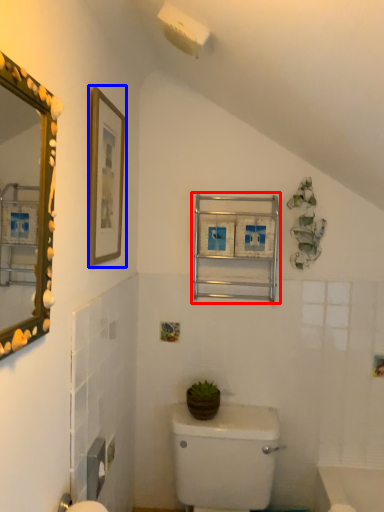
Question: Which of the following is the farthest to the observer, medicine cabinet (highlighted by a red box) or picture frame (highlighted by a blue box)?

Choices:
 (A) medicine cabinet
 (B) picture frame

Answer: (A)